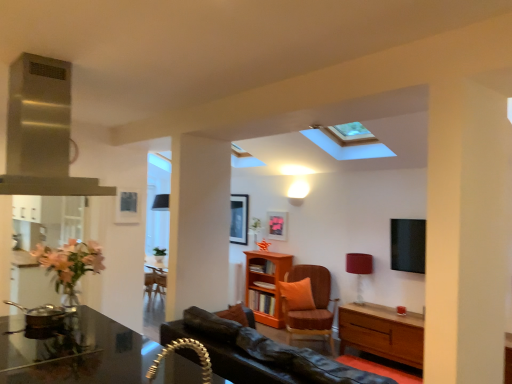
This screenshot has width=512, height=384. Describe the element at coordinates (297, 295) in the screenshot. I see `orange fabric pillow at center` at that location.

The height and width of the screenshot is (384, 512). What are the coordinates of `stainless steel exhaust hood at upper left` in the screenshot? It's located at (42, 132).

What do you see at coordinates (312, 303) in the screenshot?
I see `orange textured cushion at center` at bounding box center [312, 303].

What are the coordinates of `wooden bookshelf at center` in the screenshot? It's located at (x=266, y=285).

The image size is (512, 384). What do you see at coordinates (359, 270) in the screenshot?
I see `matte red lampshade at right` at bounding box center [359, 270].

In order to click on orange fabric pillow at center in this screenshot , I will do `click(297, 295)`.

Is stainless steel exhaust hood at upper left wider or thinner than orange textured cushion at center?

Considering their sizes, stainless steel exhaust hood at upper left looks slimmer than orange textured cushion at center.

Is stainless steel exhaust hood at upper left completely or partially outside of orange textured cushion at center?

Indeed, stainless steel exhaust hood at upper left is completely outside orange textured cushion at center.

From the image's perspective, between stainless steel exhaust hood at upper left and orange textured cushion at center, who is located below?

orange textured cushion at center, from the image's perspective.

Is stainless steel exhaust hood at upper left bigger than orange textured cushion at center?

No, stainless steel exhaust hood at upper left is not bigger than orange textured cushion at center.

Is wooden bookshelf at center bigger than orange fabric pillow at center?

Indeed, wooden bookshelf at center has a larger size compared to orange fabric pillow at center.

From their relative heights in the image, would you say wooden bookshelf at center is taller or shorter than orange fabric pillow at center?

Considering their sizes, wooden bookshelf at center has more height than orange fabric pillow at center.

From a real-world perspective, who is located lower, wooden bookshelf at center or orange fabric pillow at center?

wooden bookshelf at center is physically lower.

From the image's perspective, is matte pink picture frame at center positioned above or below orange fabric pillow at center?

matte pink picture frame at center is situated higher than orange fabric pillow at center in the image.

Considering the relative positions of matte pink picture frame at center and orange fabric pillow at center in the image provided, is matte pink picture frame at center to the left or to the right of orange fabric pillow at center?

matte pink picture frame at center is to the left of orange fabric pillow at center.

How different are the orientations of matte pink picture frame at center and orange fabric pillow at center in degrees?

53.3 degrees.

Is matte pink picture frame at center in front of orange fabric pillow at center?

No, matte pink picture frame at center is further to the viewer.

From the image's perspective, would you say orange fabric pillow at center is positioned over orange textured cushion at center?

Yes, from the image's perspective, orange fabric pillow at center is above orange textured cushion at center.

Based on their positions, is orange fabric pillow at center located to the left or right of orange textured cushion at center?

In the image, orange fabric pillow at center appears on the left side of orange textured cushion at center.

Can you confirm if orange fabric pillow at center is smaller than orange textured cushion at center?

Correct, orange fabric pillow at center occupies less space than orange textured cushion at center.

From the image's perspective, is shiny black desk at lower left under stainless steel exhaust hood at upper left?

Indeed, from the image's perspective, shiny black desk at lower left is shown beneath stainless steel exhaust hood at upper left.

Looking at this image, between shiny black desk at lower left and stainless steel exhaust hood at upper left, which one appears on the left side from the viewer's perspective?

stainless steel exhaust hood at upper left is more to the left.

Based on the photo, which object is wider, shiny black desk at lower left or stainless steel exhaust hood at upper left?

shiny black desk at lower left.

Is point (85, 323) farther from camera compared to point (31, 97)?

Yes, it is behind point (31, 97).

Between stainless steel exhaust hood at upper left and matte red lampshade at right, which one is positioned in front?

stainless steel exhaust hood at upper left is more forward.

Considering the positions of point (28, 70) and point (360, 265), is point (28, 70) closer or farther from the camera than point (360, 265)?

Clearly, point (28, 70) is closer to the camera than point (360, 265).

Looking at this image, in terms of width, does stainless steel exhaust hood at upper left look wider or thinner when compared to matte red lampshade at right?

Clearly, stainless steel exhaust hood at upper left has more width compared to matte red lampshade at right.

From a real-world perspective, which is physically below, stainless steel exhaust hood at upper left or matte red lampshade at right?

From a 3D spatial view, matte red lampshade at right is below.

Visually, is orange textured cushion at center positioned to the left or to the right of matte red lampshade at right?

orange textured cushion at center is to the left of matte red lampshade at right.

Is orange textured cushion at center looking in the opposite direction of matte red lampshade at right?

That's not correct — orange textured cushion at center is not looking away from matte red lampshade at right.

Looking at this image, from a real-world perspective, is orange textured cushion at center below matte red lampshade at right?

Yes, from a real-world perspective, orange textured cushion at center is under matte red lampshade at right.

Considering the sizes of objects orange textured cushion at center and matte red lampshade at right in the image provided, who is thinner, orange textured cushion at center or matte red lampshade at right?

With smaller width is matte red lampshade at right.

Where is `chair located behind the stainless steel exhaust hood at upper left`? chair located behind the stainless steel exhaust hood at upper left is located at coordinates (312, 303).

The image size is (512, 384). In order to click on shelf to the left of orange fabric pillow at center in this screenshot , I will do `click(266, 285)`.

Looking at this image, looking at the image, which one is located closer to matte pink picture frame at center, matte red lampshade at right or shiny black desk at lower left?

Based on the image, matte red lampshade at right appears to be nearer to matte pink picture frame at center.

Which object lies further to the anchor point stainless steel exhaust hood at upper left, orange textured cushion at center or wooden bookshelf at center?

wooden bookshelf at center is further to stainless steel exhaust hood at upper left.

Based on their spatial positions, is orange fabric pillow at center or wooden bookshelf at center further from orange textured cushion at center?

wooden bookshelf at center.

Estimate the real-world distances between objects in this image. Which object is further from orange fabric pillow at center, shiny black desk at lower left or orange textured cushion at center?

shiny black desk at lower left is further to orange fabric pillow at center.

From the image, which object appears to be farther from matte red lampshade at right, stainless steel exhaust hood at upper left or orange fabric pillow at center?

stainless steel exhaust hood at upper left is positioned further to the anchor matte red lampshade at right.

Looking at the image, which one is located further to shiny black desk at lower left, matte pink picture frame at center or wooden bookshelf at center?

matte pink picture frame at center is positioned further to the anchor shiny black desk at lower left.

Considering their positions, is orange textured cushion at center positioned further to matte red lampshade at right than stainless steel exhaust hood at upper left?

Based on the image, stainless steel exhaust hood at upper left appears to be further to matte red lampshade at right.

Which object lies nearer to the anchor point orange textured cushion at center, wooden bookshelf at center or matte pink picture frame at center?

wooden bookshelf at center is closer to orange textured cushion at center.

At what (x,y) coordinates should I click in order to perform the action: click on chair between shiny black desk at lower left and orange fabric pillow at center from front to back. Please return your answer as a coordinate pair (x, y). This screenshot has height=384, width=512. Looking at the image, I should click on (312, 303).

Image resolution: width=512 pixels, height=384 pixels. Identify the location of lamp between stainless steel exhaust hood at upper left and orange fabric pillow at center along the z-axis. (359, 270).

Locate an element on the screen. shelf located between matte red lampshade at right and matte pink picture frame at center in the depth direction is located at coordinates (266, 285).

The width and height of the screenshot is (512, 384). Find the location of `shelf between stainless steel exhaust hood at upper left and matte pink picture frame at center along the z-axis`. shelf between stainless steel exhaust hood at upper left and matte pink picture frame at center along the z-axis is located at coordinates (266, 285).